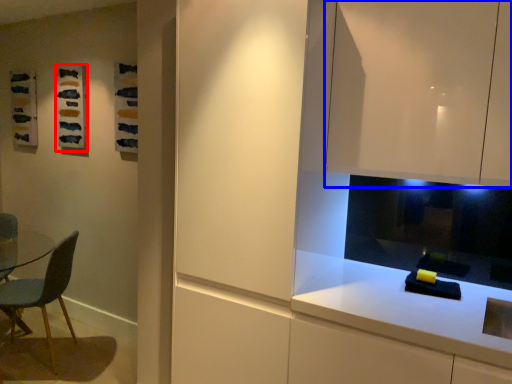
Question: Which object is further to the camera taking this photo, art (highlighted by a red box) or cabinetry (highlighted by a blue box)?

Choices:
 (A) art
 (B) cabinetry

Answer: (A)